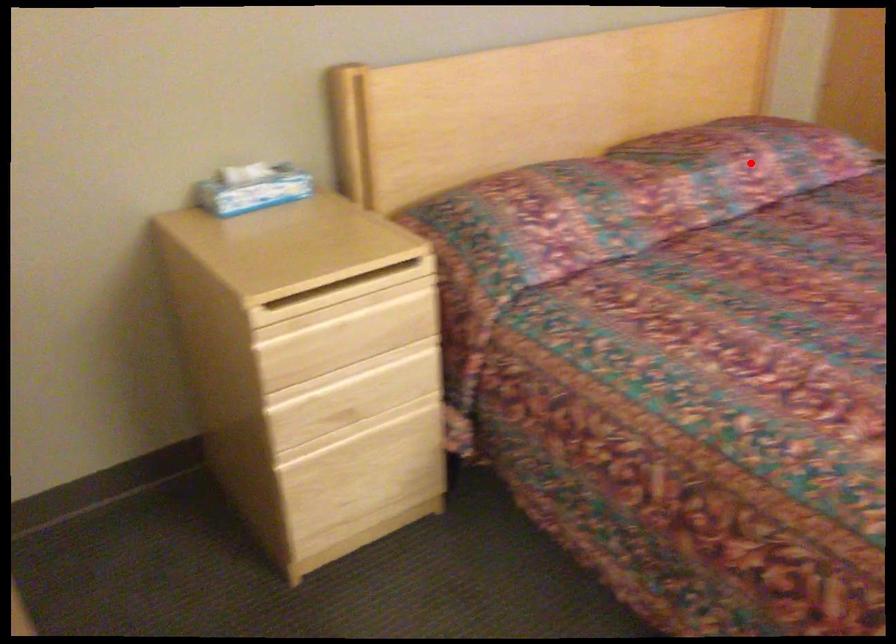
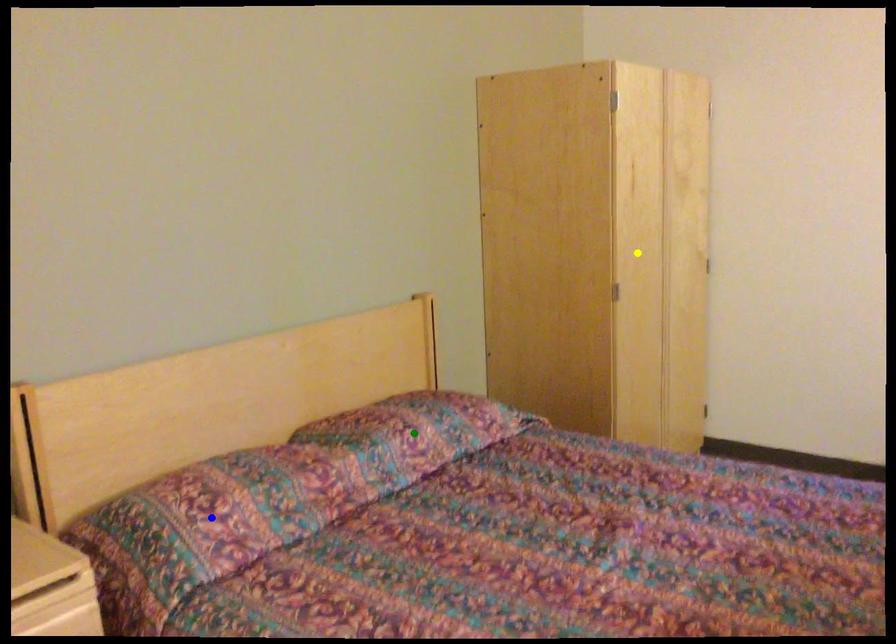
Question: I am providing you with two images of the same scene from different viewpoints. A red point is marked on the first image. You are given multiple points on the second image. Can you choose the point in image 2 that corresponds to the point in image 1?

Choices:
 (A) yellow point
 (B) blue point
 (C) green point

Answer: (C)